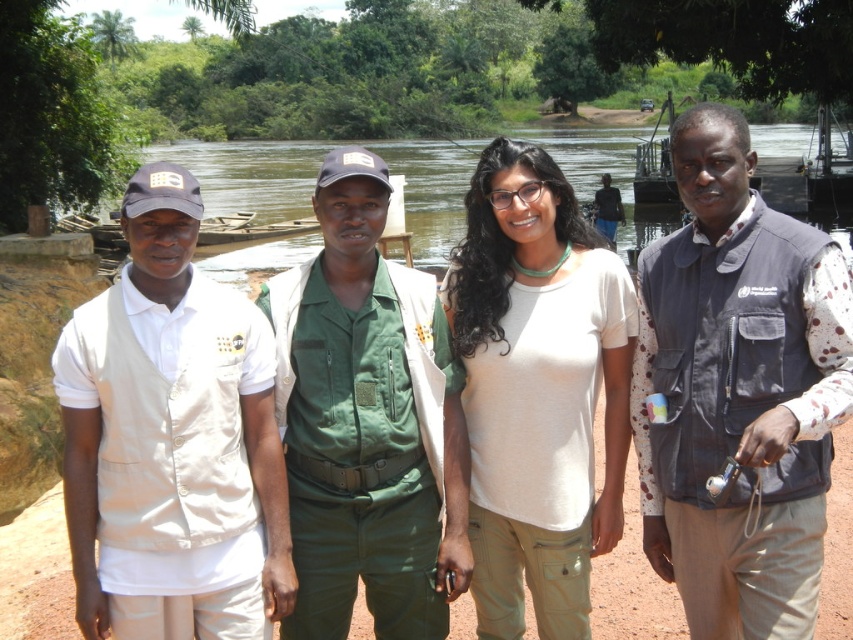
The height and width of the screenshot is (640, 853). What do you see at coordinates (172, 440) in the screenshot?
I see `beige fabric vest at left` at bounding box center [172, 440].

Who is positioned more to the right, beige fabric vest at left or green uniform at center?

green uniform at center is more to the right.

Is point (242, 429) more distant than point (344, 416)?

No.

Where is `beige fabric vest at left`? This screenshot has width=853, height=640. beige fabric vest at left is located at coordinates (172, 440).

From the picture: Is dark gray vest at right above brown wooden river at center?

Incorrect, dark gray vest at right is not positioned above brown wooden river at center.

This screenshot has width=853, height=640. Identify the location of dark gray vest at right. (738, 390).

The image size is (853, 640). Find the location of `dark gray vest at right`. dark gray vest at right is located at coordinates (738, 390).

Based on the photo, can you confirm if white matte shirt at center is wider than brown wooden river at center?

No.

Can you confirm if white matte shirt at center is taller than brown wooden river at center?

Incorrect, white matte shirt at center's height is not larger of brown wooden river at center's.

Is point (602, 333) less distant than point (292, 145)?

Yes.

Identify the location of white matte shirt at center. The image size is (853, 640). (537, 388).